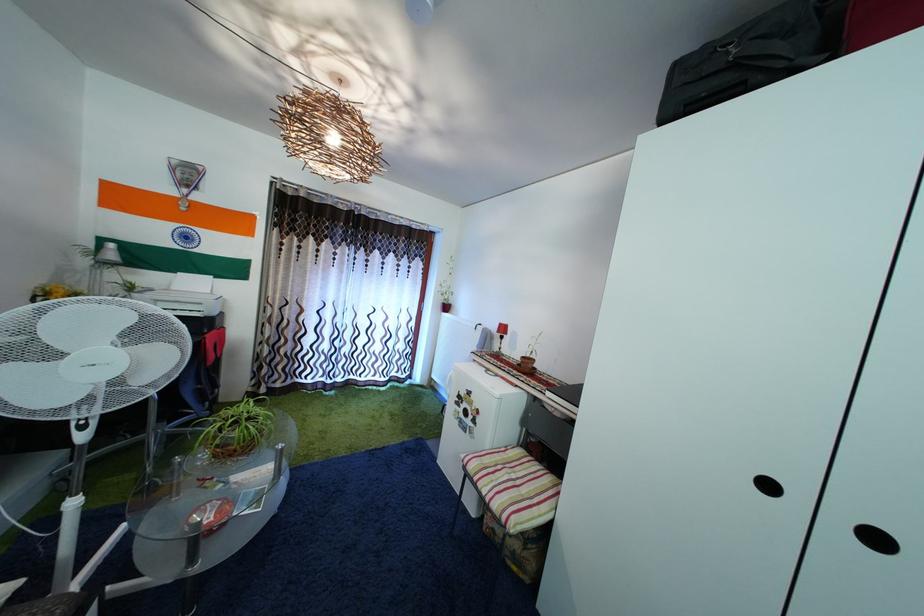
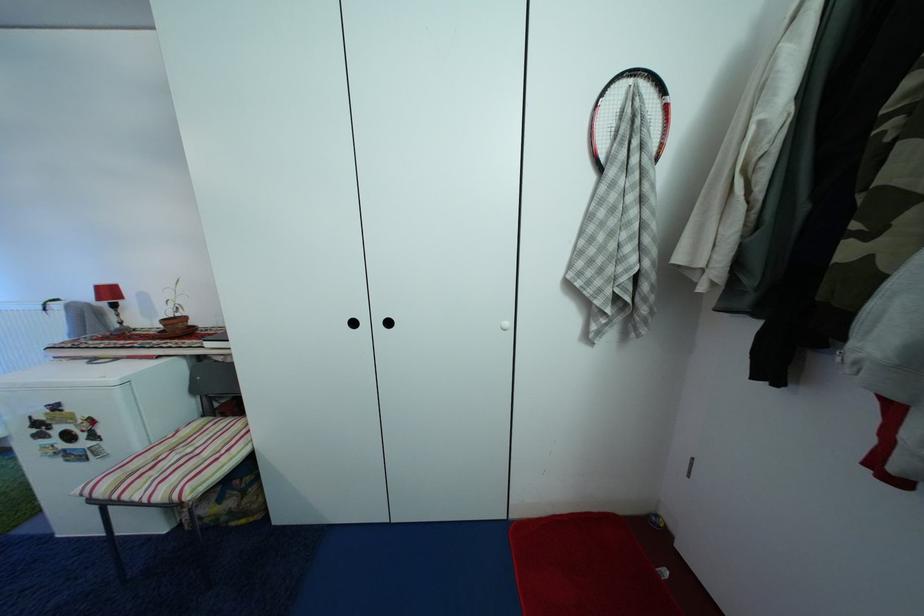
Find the pixel in the second image that matches (508,331) in the first image.

(106, 294)